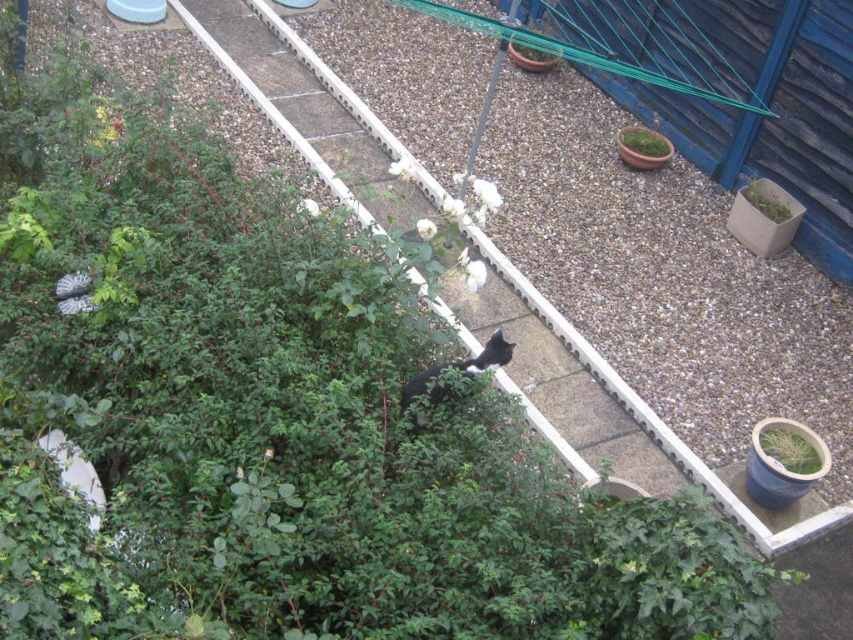
In the scene shown: You are a gardener checking the garden layout. You notice the black fur cat at center and the green leafy plant at upper right. Which object is taller?

The black fur cat at center is taller than the green leafy plant at upper right.

You are a gardener who wants to trim the plants in the garden. Since the cat might be hiding among the plants, you need to know which plant is taller to avoid disturbing the cat. Which object is taller, the green leafy plant at lower right or the black fur cat at center?

The green leafy plant at lower right has a lesser height compared to the black fur cat at center, so the black fur cat at center is taller. Therefore, you should be cautious around the black fur cat at center to avoid disturbing it.

Consider the image. You are a photographer trying to capture the black fur cat at center and the green mossy pot at upper right in the same frame. Based on their sizes, which one will appear larger in the photo?

The black fur cat at center is taller than the green mossy pot at upper right, so it will appear larger in the photo.